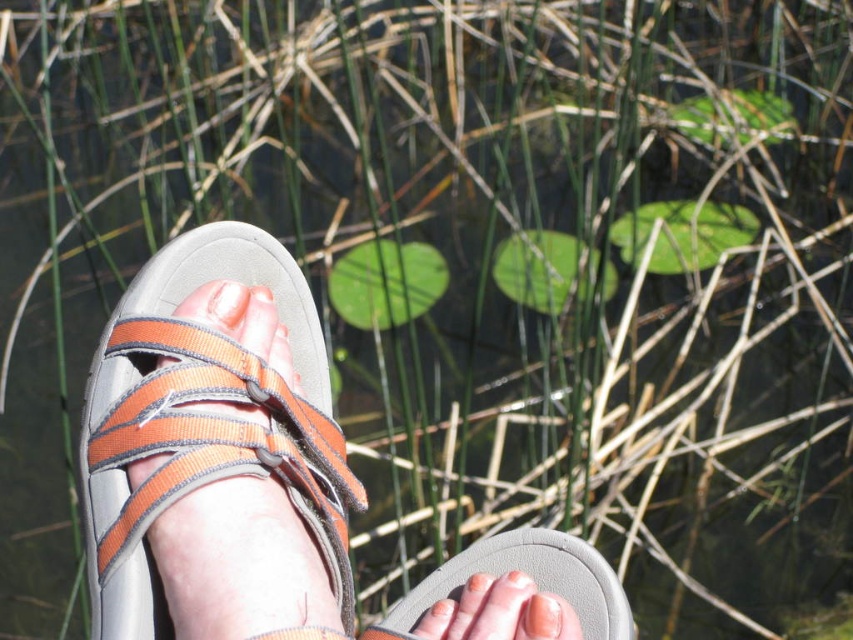
From the picture: Can you confirm if gray rubber sandal at lower center is positioned below pink flesh at center?

Correct, gray rubber sandal at lower center is located below pink flesh at center.

The image size is (853, 640). What do you see at coordinates (527, 577) in the screenshot? I see `gray rubber sandal at lower center` at bounding box center [527, 577].

Find the location of a particular element. The height and width of the screenshot is (640, 853). gray rubber sandal at lower center is located at coordinates (527, 577).

Does orange fabric sandal at left appear on the left side of gray rubber sandal at lower center?

Correct, you'll find orange fabric sandal at left to the left of gray rubber sandal at lower center.

Describe the element at coordinates (202, 420) in the screenshot. I see `orange fabric sandal at left` at that location.

At what (x,y) coordinates should I click in order to perform the action: click on orange fabric sandal at left. Please return your answer as a coordinate pair (x, y). Looking at the image, I should click on (202, 420).

Which is more to the left, orange fabric sandal at left or matte orange nail at lower center?

Positioned to the left is orange fabric sandal at left.

Is point (345, 518) positioned after point (535, 593)?

Yes, it is behind point (535, 593).

Which is behind, point (102, 520) or point (560, 611)?

The point (560, 611) is behind.

Where is `orange fabric sandal at left`? orange fabric sandal at left is located at coordinates (202, 420).